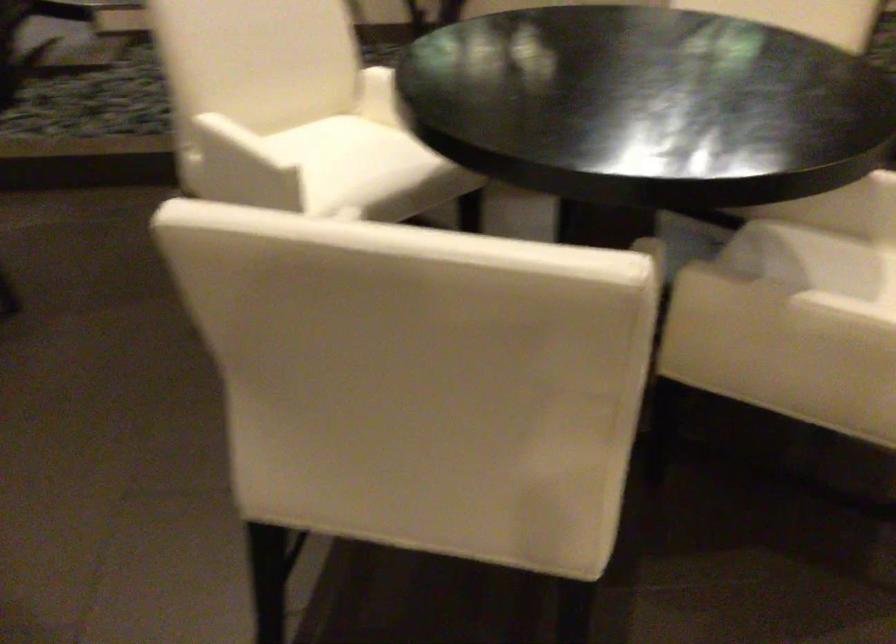
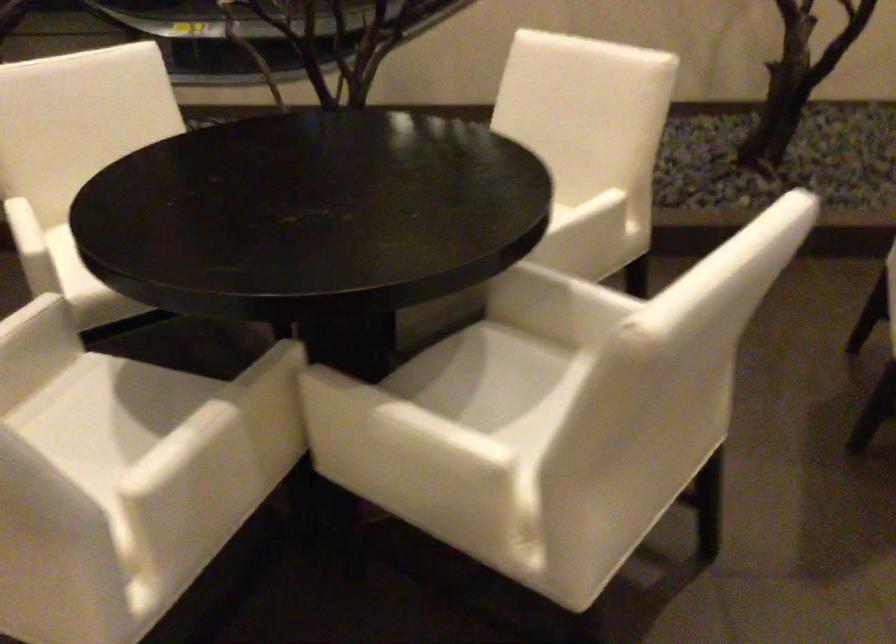
Question: The camera is either moving clockwise (left) or counter-clockwise (right) around the object. The first image is from the beginning of the video and the second image is from the end. Is the camera moving left or right when shooting the video?

Choices:
 (A) Left
 (B) Right

Answer: (B)